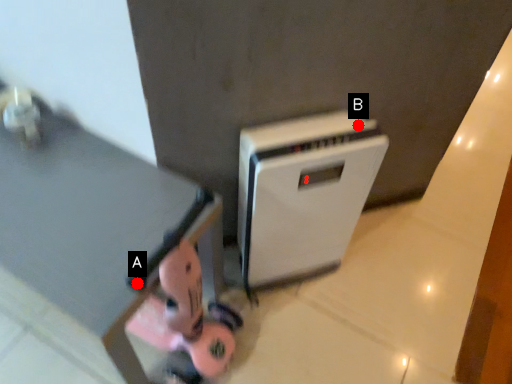
Question: Two points are circled on the image, labeled by A and B beside each circle. Which point is closer to the camera taking this photo?

Choices:
 (A) A is closer
 (B) B is closer

Answer: (A)